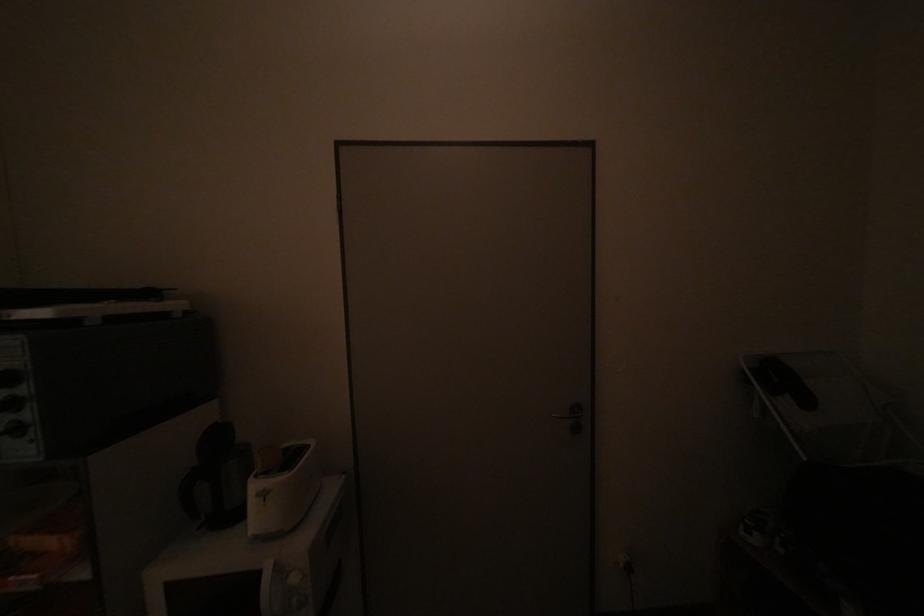
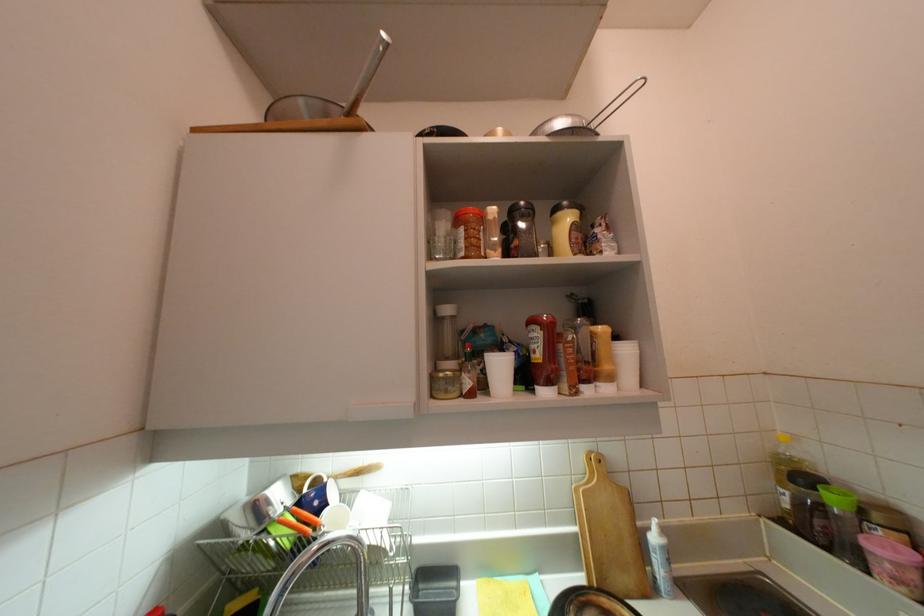
Question: Which direction would the cameraman need to move to produce the second image? Reply with the corresponding letter.

Choices:
 (A) Left
 (B) Right
 (C) Forward
 (D) Backward

Answer: (A)